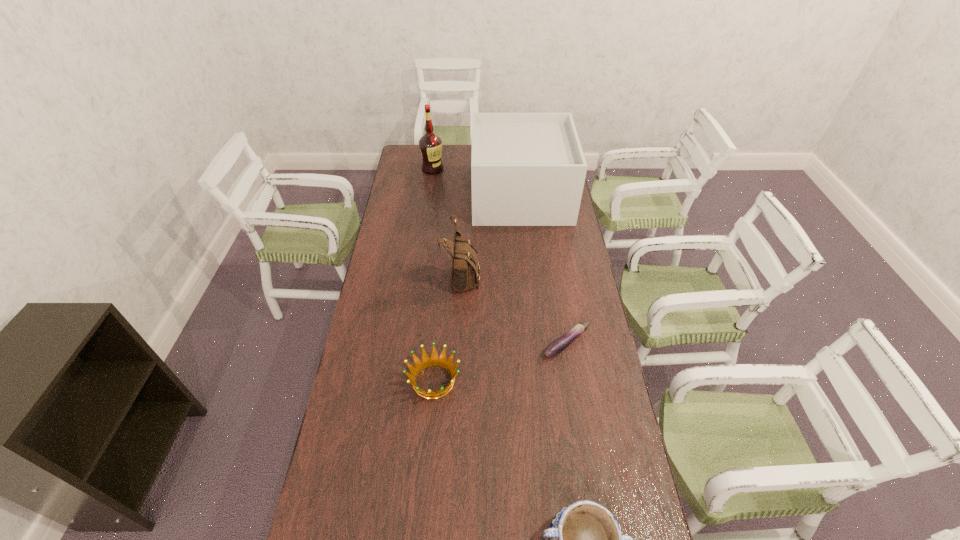
Locate an element on the screen. free space located 0.160m on the back of the second shortest object is located at coordinates (439, 321).

The height and width of the screenshot is (540, 960). Identify the location of free space located on the left of the eggplant. (483, 344).

The height and width of the screenshot is (540, 960). In order to click on object positioned at the far edge in this screenshot , I will do `click(430, 144)`.

Locate an element on the screen. This screenshot has height=540, width=960. object that is at the left edge is located at coordinates (430, 144).

What are the coordinates of `box that is at the right edge` in the screenshot? It's located at (527, 169).

Where is `eggplant positioned at the right edge`? The width and height of the screenshot is (960, 540). eggplant positioned at the right edge is located at coordinates (557, 346).

Locate an element on the screen. object that is at the far left corner is located at coordinates (430, 144).

I want to click on free space at the far edge, so click(x=467, y=153).

Locate an element on the screen. vacant space at the left edge of the desktop is located at coordinates (424, 197).

Where is `free space at the right edge of the desktop`? free space at the right edge of the desktop is located at coordinates (551, 273).